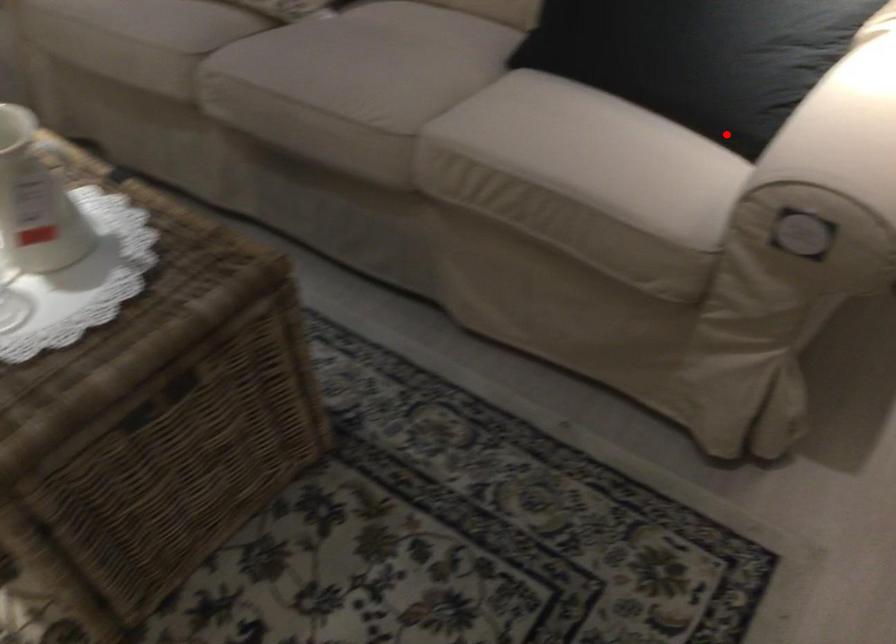
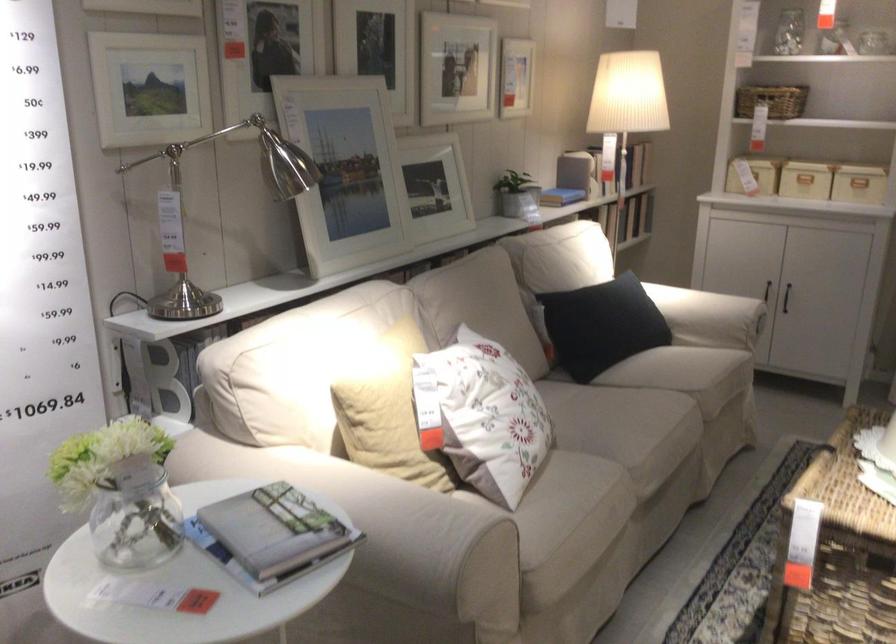
Locate, in the second image, the point that corresponds to the highlighted location in the first image.

(709, 317)